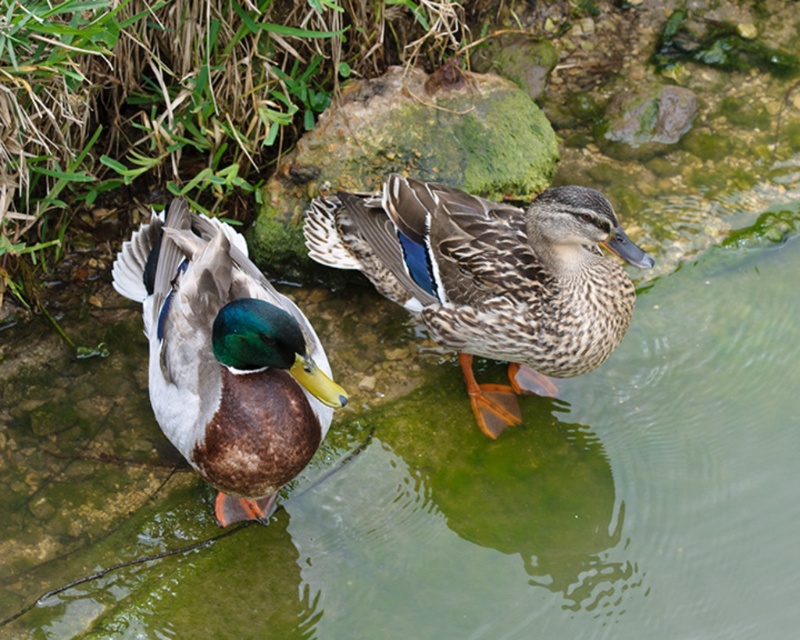
You are standing 3 meters away from the camera. Can you see the point at coordinates point (x=318, y=248)?

The point at coordinates point (x=318, y=248) is 2.89 meters away from the camera. Since you are standing 3 meters away from the camera, you are slightly farther than the point, so you can see the point at coordinates point (x=318, y=248).

In the scene shown: You are a photographer aiming to capture both the speckled feathered duck at center and the green mossy rock at center in the same frame. Based on their positions, which object should you focus on first to ensure both are in focus?

The speckled feathered duck at center is located below the green mossy rock at center, so you should focus on the green mossy rock at center first to ensure both are in focus.